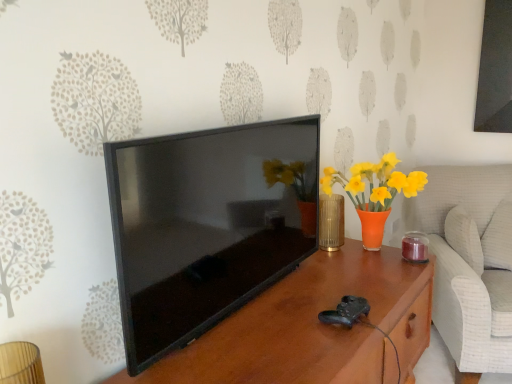
Question: Considering the positions of white textured swivel chair at right and black glossy tv at center in the image, is white textured swivel chair at right wider or thinner than black glossy tv at center?

Choices:
 (A) thin
 (B) wide

Answer: (B)

Question: Is point (450, 321) closer or farther from the camera than point (239, 172)?

Choices:
 (A) closer
 (B) farther

Answer: (B)

Question: Which object is positioned farthest from the white textured swivel chair at right?

Choices:
 (A) brown wood table at center
 (B) gold textured vase at center
 (C) black glossy tv at center

Answer: (C)

Question: Considering the real-world distances, which object is farthest from the gold textured vase at center?

Choices:
 (A) brown wood table at center
 (B) black glossy tv at center
 (C) white textured swivel chair at right

Answer: (C)